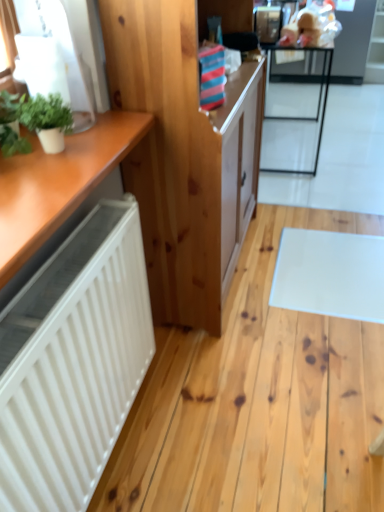
Describe the element at coordinates (182, 156) in the screenshot. The height and width of the screenshot is (512, 384). I see `natural wood cabinet at center` at that location.

What do you see at coordinates (47, 120) in the screenshot? Image resolution: width=384 pixels, height=512 pixels. I see `green matte plant at upper left, positioned as the 2th houseplant in left-to-right order` at bounding box center [47, 120].

Measure the distance between green matte plant at upper left, positioned as the 2th houseplant in left-to-right order, and camera.

36.50 inches.

Where is `green leafy plant at left, which is the second houseplant from right to left`? The width and height of the screenshot is (384, 512). green leafy plant at left, which is the second houseplant from right to left is located at coordinates (10, 125).

At what (x,y) coordinates should I click in order to perform the action: click on natural wood cabinet at center. Please return your answer as a coordinate pair (x, y). The height and width of the screenshot is (512, 384). Looking at the image, I should click on (182, 156).

Can you confirm if green leafy plant at left, positioned as the 1th houseplant in left-to-right order, is thinner than green matte plant at upper left, which is the first houseplant in right-to-left order?

Yes, green leafy plant at left, positioned as the 1th houseplant in left-to-right order, is thinner than green matte plant at upper left, which is the first houseplant in right-to-left order.

Considering the sizes of objects green leafy plant at left, which is the second houseplant from right to left, and green matte plant at upper left, positioned as the 2th houseplant in left-to-right order, in the image provided, who is smaller, green leafy plant at left, which is the second houseplant from right to left, or green matte plant at upper left, positioned as the 2th houseplant in left-to-right order,?

green matte plant at upper left, positioned as the 2th houseplant in left-to-right order.

Considering the relative positions of green leafy plant at left, which is the second houseplant from right to left, and green matte plant at upper left, positioned as the 2th houseplant in left-to-right order, in the image provided, is green leafy plant at left, which is the second houseplant from right to left, to the right of green matte plant at upper left, positioned as the 2th houseplant in left-to-right order, from the viewer's perspective?

In fact, green leafy plant at left, which is the second houseplant from right to left, is to the left of green matte plant at upper left, positioned as the 2th houseplant in left-to-right order.

Is green leafy plant at left, positioned as the 1th houseplant in left-to-right order, facing away from green matte plant at upper left, positioned as the 2th houseplant in left-to-right order?

No, green leafy plant at left, positioned as the 1th houseplant in left-to-right order, is not facing away from green matte plant at upper left, positioned as the 2th houseplant in left-to-right order.

Could you tell me if green matte plant at upper left, which is the first houseplant in right-to-left order, is facing natural wood cabinet at center?

No, green matte plant at upper left, which is the first houseplant in right-to-left order, does not turn towards natural wood cabinet at center.

Based on the photo, who is more distant, green matte plant at upper left, positioned as the 2th houseplant in left-to-right order, or natural wood cabinet at center?

natural wood cabinet at center is more distant.

The image size is (384, 512). Identify the location of houseplant that is the 2nd object above the natural wood cabinet at center (from a real-world perspective). (47, 120).

Consider the image. From the image's perspective, who appears lower, green matte plant at upper left, positioned as the 2th houseplant in left-to-right order, or natural wood cabinet at center?

green matte plant at upper left, positioned as the 2th houseplant in left-to-right order, is shown below in the image.

Identify the location of cabinetry below the metallic black table at upper right (from the image's perspective). This screenshot has height=512, width=384. (182, 156).

Considering the sizes of objects natural wood cabinet at center and metallic black table at upper right in the image provided, who is smaller, natural wood cabinet at center or metallic black table at upper right?

metallic black table at upper right is smaller.

Is natural wood cabinet at center taller than metallic black table at upper right?

Yes, natural wood cabinet at center is taller than metallic black table at upper right.

From the image's perspective, is natural wood cabinet at center above metallic black table at upper right?

No, from the image's perspective, natural wood cabinet at center is not above metallic black table at upper right.

From a real-world perspective, is green matte plant at upper left, which is the first houseplant in right-to-left order, above or below metallic black table at upper right?

From a real-world perspective, green matte plant at upper left, which is the first houseplant in right-to-left order, is physically above metallic black table at upper right.

Which is more to the left, green matte plant at upper left, which is the first houseplant in right-to-left order, or metallic black table at upper right?

From the viewer's perspective, green matte plant at upper left, which is the first houseplant in right-to-left order, appears more on the left side.

Is green matte plant at upper left, which is the first houseplant in right-to-left order, bigger or smaller than metallic black table at upper right?

Clearly, green matte plant at upper left, which is the first houseplant in right-to-left order, is smaller in size than metallic black table at upper right.

How far apart are metallic black table at upper right and green leafy plant at left, which is the second houseplant from right to left?

metallic black table at upper right and green leafy plant at left, which is the second houseplant from right to left, are 2.77 meters apart.

Is metallic black table at upper right beside green leafy plant at left, which is the second houseplant from right to left?

No, metallic black table at upper right is not with green leafy plant at left, which is the second houseplant from right to left.

In terms of width, does metallic black table at upper right look wider or thinner when compared to green leafy plant at left, positioned as the 1th houseplant in left-to-right order?

In the image, metallic black table at upper right appears to be wider than green leafy plant at left, positioned as the 1th houseplant in left-to-right order.

From the image's perspective, relative to green matte plant at upper left, positioned as the 2th houseplant in left-to-right order, is metallic black table at upper right above or below?

Clearly, from the image's perspective, metallic black table at upper right is above green matte plant at upper left, positioned as the 2th houseplant in left-to-right order.

From the picture: Considering the relative sizes of metallic black table at upper right and green matte plant at upper left, positioned as the 2th houseplant in left-to-right order, in the image provided, is metallic black table at upper right thinner than green matte plant at upper left, positioned as the 2th houseplant in left-to-right order,?

Incorrect, the width of metallic black table at upper right is not less than that of green matte plant at upper left, positioned as the 2th houseplant in left-to-right order.

The width and height of the screenshot is (384, 512). I want to click on table behind the green matte plant at upper left, positioned as the 2th houseplant in left-to-right order, so click(x=295, y=115).

Is metallic black table at upper right far from green matte plant at upper left, positioned as the 2th houseplant in left-to-right order?

metallic black table at upper right is positioned a significant distance from green matte plant at upper left, positioned as the 2th houseplant in left-to-right order.

Considering the positions of points (6, 110) and (278, 153), is point (6, 110) farther from camera compared to point (278, 153)?

No, (6, 110) is closer to viewer.

Is green leafy plant at left, positioned as the 1th houseplant in left-to-right order, next to metallic black table at upper right?

green leafy plant at left, positioned as the 1th houseplant in left-to-right order, and metallic black table at upper right are clearly separated.

Considering the positions of objects green leafy plant at left, positioned as the 1th houseplant in left-to-right order, and metallic black table at upper right in the image provided, who is in front, green leafy plant at left, positioned as the 1th houseplant in left-to-right order, or metallic black table at upper right?

green leafy plant at left, positioned as the 1th houseplant in left-to-right order, is closer to the camera.

Considering the sizes of objects green leafy plant at left, which is the second houseplant from right to left, and metallic black table at upper right in the image provided, who is taller, green leafy plant at left, which is the second houseplant from right to left, or metallic black table at upper right?

metallic black table at upper right.

You are a GUI agent. You are given a task and a screenshot of the screen. Output one action in this format:
    pyautogui.click(x=<x>, y=<y>)
    Task: Click on the houseplant below the green matte plant at upper left, which is the first houseplant in right-to-left order (from a real-world perspective)
    Image resolution: width=384 pixels, height=512 pixels.
    Given the screenshot: What is the action you would take?
    pyautogui.click(x=10, y=125)

Identify the location of cabinetry located behind the green matte plant at upper left, which is the first houseplant in right-to-left order. point(182,156).

When comparing their distances from green matte plant at upper left, which is the first houseplant in right-to-left order, does metallic black table at upper right or natural wood cabinet at center seem further?

metallic black table at upper right.

Based on their spatial positions, is metallic black table at upper right or green leafy plant at left, which is the second houseplant from right to left, closer to natural wood cabinet at center?

Among the two, green leafy plant at left, which is the second houseplant from right to left, is located nearer to natural wood cabinet at center.

When comparing their distances from green leafy plant at left, positioned as the 1th houseplant in left-to-right order, does metallic black table at upper right or natural wood cabinet at center seem closer?

natural wood cabinet at center.

When comparing their distances from green matte plant at upper left, which is the first houseplant in right-to-left order, does green leafy plant at left, which is the second houseplant from right to left, or metallic black table at upper right seem further?

Based on the image, metallic black table at upper right appears to be further to green matte plant at upper left, which is the first houseplant in right-to-left order.

Based on the photo, based on their spatial positions, is metallic black table at upper right or green leafy plant at left, which is the second houseplant from right to left, closer to green matte plant at upper left, positioned as the 2th houseplant in left-to-right order?

Based on the image, green leafy plant at left, which is the second houseplant from right to left, appears to be nearer to green matte plant at upper left, positioned as the 2th houseplant in left-to-right order.

When comparing their distances from green matte plant at upper left, positioned as the 2th houseplant in left-to-right order, does green leafy plant at left, which is the second houseplant from right to left, or natural wood cabinet at center seem further?

Based on the image, natural wood cabinet at center appears to be further to green matte plant at upper left, positioned as the 2th houseplant in left-to-right order.

Based on their spatial positions, is green matte plant at upper left, positioned as the 2th houseplant in left-to-right order, or green leafy plant at left, which is the second houseplant from right to left, further from metallic black table at upper right?

Based on the image, green leafy plant at left, which is the second houseplant from right to left, appears to be further to metallic black table at upper right.

When comparing their distances from metallic black table at upper right, does natural wood cabinet at center or green matte plant at upper left, positioned as the 2th houseplant in left-to-right order, seem closer?

natural wood cabinet at center.

The width and height of the screenshot is (384, 512). Identify the location of houseplant positioned between green matte plant at upper left, which is the first houseplant in right-to-left order, and metallic black table at upper right from near to far. (10, 125).

At what (x,y) coordinates should I click in order to perform the action: click on houseplant located between green leafy plant at left, positioned as the 1th houseplant in left-to-right order, and natural wood cabinet at center in the left-right direction. Please return your answer as a coordinate pair (x, y). Looking at the image, I should click on (47, 120).

You are a GUI agent. You are given a task and a screenshot of the screen. Output one action in this format:
    pyautogui.click(x=<x>, y=<y>)
    Task: Click on the cabinetry positioned between green leafy plant at left, which is the second houseplant from right to left, and metallic black table at upper right from near to far
    This screenshot has height=512, width=384.
    Given the screenshot: What is the action you would take?
    pyautogui.click(x=182, y=156)

Locate an element on the screen. cabinetry between green matte plant at upper left, which is the first houseplant in right-to-left order, and metallic black table at upper right, along the z-axis is located at coordinates (182, 156).